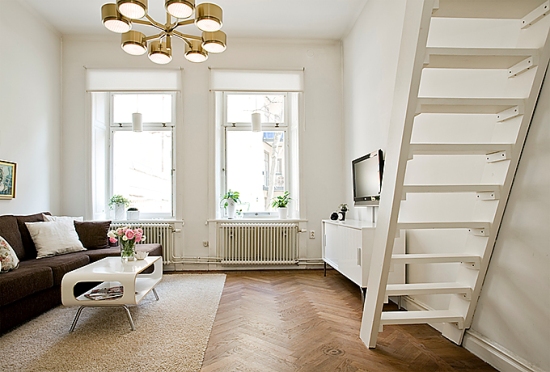
Where is `stairs`? The image size is (550, 372). stairs is located at coordinates (412, 219).